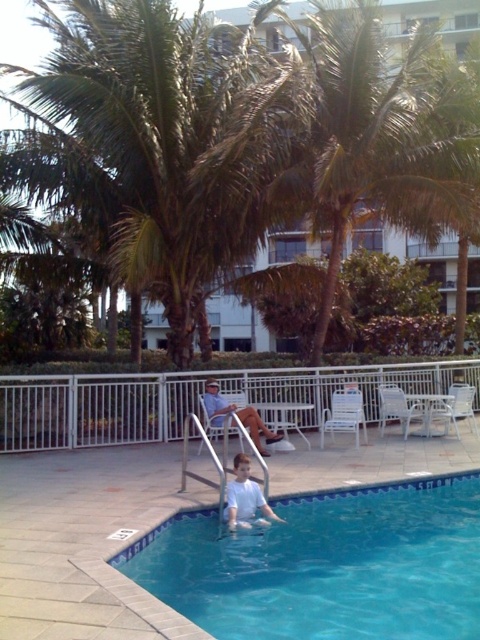
You are a guest staying at the resort and want to take a photo of the green leafy palm tree at center and the white matte shirt at lower center. From your current position, which object is higher in the frame?

The green leafy palm tree at center is located above the white matte shirt at lower center, so it is higher in the frame.

You are a guest staying at this hotel and want to sit down on the white fabric chair at center. However, there is a white matte shirt at lower center in the way. Can you move the chair to the right to avoid the shirt?

The white matte shirt at lower center is in front of the white fabric chair at center, so moving the chair to the right would not avoid the shirt since the shirt is already blocking the front of the chair. You might need to move the shirt instead.